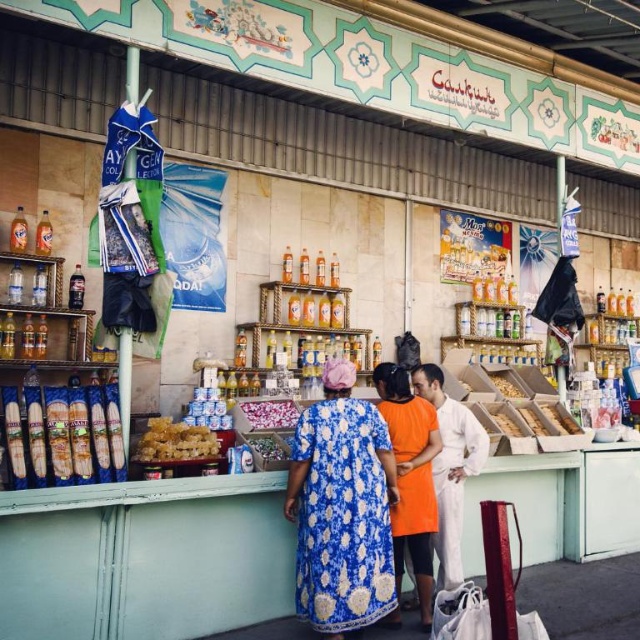
Is shiny plastic candy at center below golden brown bread at center?

Yes, shiny plastic candy at center is below golden brown bread at center.

Can you confirm if shiny plastic candy at center is positioned to the left of golden brown bread at center?

Correct, you'll find shiny plastic candy at center to the left of golden brown bread at center.

Which is behind, point (278, 442) or point (499, 378)?

The point (499, 378) is behind.

This screenshot has width=640, height=640. What are the coordinates of `shiny plastic candy at center` in the screenshot? It's located at (268, 445).

Is orange cotton dress at center in front of shiny plastic candy at center?

That is True.

Between point (397, 588) and point (266, 438), which one is positioned in front?

Positioned in front is point (397, 588).

Is point (416, 524) positioned before point (252, 448)?

Yes, point (416, 524) is closer to viewer.

Locate an element on the screen. This screenshot has height=640, width=640. orange cotton dress at center is located at coordinates (410, 477).

Does pink fabric at center have a smaller size compared to golden brown bread at center?

Yes.

Does pink fabric at center appear on the right side of golden brown bread at center?

In fact, pink fabric at center is to the left of golden brown bread at center.

I want to click on pink fabric at center, so click(x=269, y=413).